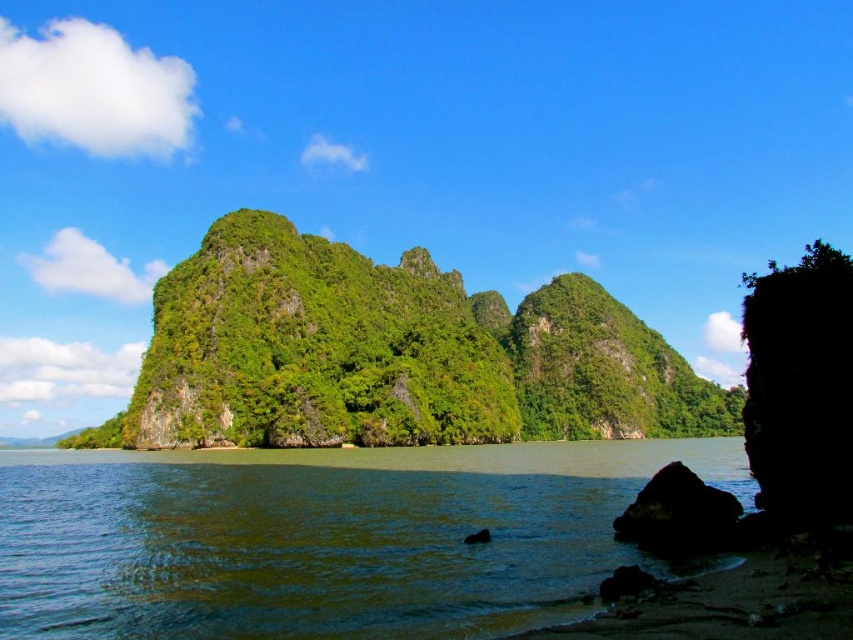
Question: Can you confirm if green water at lower left is positioned to the right of black rock at lower right?

Choices:
 (A) yes
 (B) no

Answer: (B)

Question: Among these objects, which one is nearest to the camera?

Choices:
 (A) green rocky island at center
 (B) green water at lower left
 (C) black rock at lower right

Answer: (B)

Question: From the image, what is the correct spatial relationship of green water at lower left in relation to black rock at lower right?

Choices:
 (A) below
 (B) above

Answer: (A)

Question: Which point appears farthest from the camera in this image?

Choices:
 (A) (541, 308)
 (B) (291, 625)

Answer: (A)

Question: Which of the following is the farthest from the observer?

Choices:
 (A) (236, 556)
 (B) (339, 266)

Answer: (B)

Question: Is green water at lower left to the right of black rock at lower right from the viewer's perspective?

Choices:
 (A) no
 (B) yes

Answer: (A)